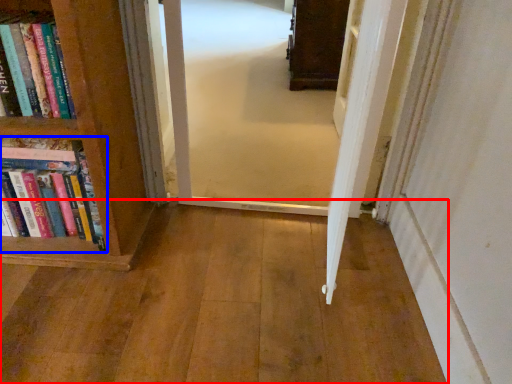
Question: Which of the following is the farthest to the observer, corridor (highlighted by a red box) or book (highlighted by a blue box)?

Choices:
 (A) corridor
 (B) book

Answer: (B)